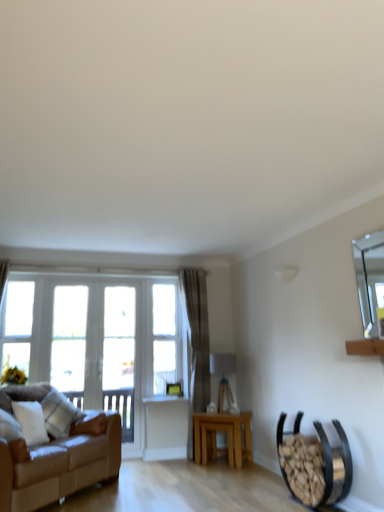
Question: Does point (6, 270) appear closer or farther from the camera than point (122, 310)?

Choices:
 (A) closer
 (B) farther

Answer: (A)

Question: Considering the relative positions of white sheer curtain at left, placed as the second curtain when sorted from back to front, and white wood glass door at left in the image provided, is white sheer curtain at left, placed as the second curtain when sorted from back to front, to the left or to the right of white wood glass door at left?

Choices:
 (A) right
 (B) left

Answer: (B)

Question: Which of these objects is positioned closest to the white painted wood window frame at center?

Choices:
 (A) white sheer curtain at left, the first curtain when ordered from left to right
 (B) white wood glass door at left
 (C) matte gray curtain at center, the 2th curtain positioned from the front
 (D) clear glass window at left, which is the second window from right to left
 (E) light brown wooden table at center

Answer: (B)

Question: Estimate the real-world distances between objects in this image. Which object is farther from the clear glass window at center, the 1th window from the right?

Choices:
 (A) white painted wood window frame at center
 (B) clear glass window at left, positioned as the 2th window in left-to-right order
 (C) brown leather couch at left
 (D) white sheer curtain at left, placed as the second curtain when sorted from back to front
 (E) light brown wooden table at center

Answer: (D)